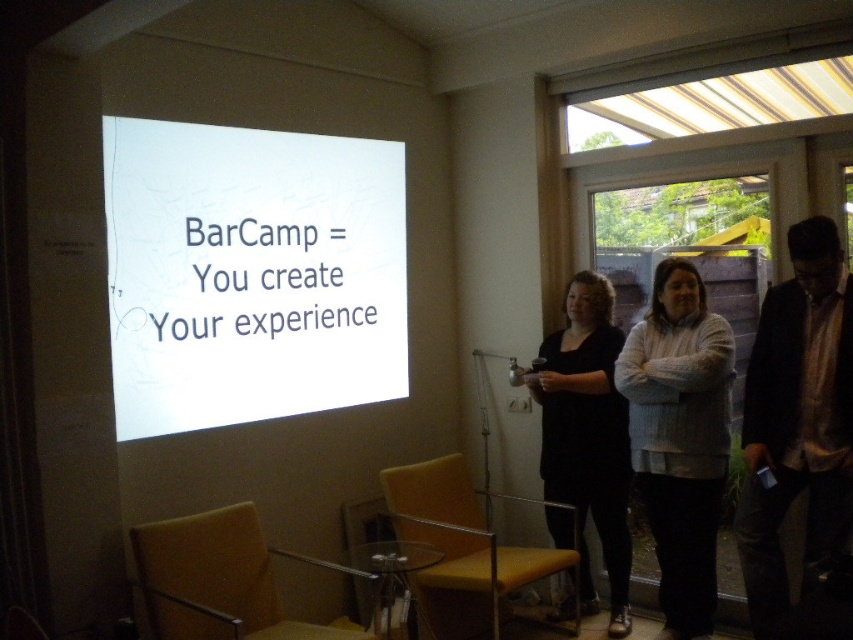
Question: Which object is closer to the camera taking this photo?

Choices:
 (A) white knitted sweater at center
 (B) matte black dress at center
 (C) white paper at upper center

Answer: (C)

Question: Is matte yellow armchair at lower left below yellow leather armchair at center?

Choices:
 (A) yes
 (B) no

Answer: (A)

Question: Which object appears farthest from the camera in this image?

Choices:
 (A) white paper at upper center
 (B) matte yellow armchair at lower left
 (C) white knitted sweater at center
 (D) dark brown suit at right

Answer: (C)

Question: Is dark brown suit at right thinner than white knitted sweater at center?

Choices:
 (A) no
 (B) yes

Answer: (B)

Question: Does dark brown suit at right appear under matte yellow armchair at lower left?

Choices:
 (A) yes
 (B) no

Answer: (B)

Question: Which of these objects is positioned farthest from the matte black dress at center?

Choices:
 (A) dark brown suit at right
 (B) matte yellow armchair at lower left
 (C) white paper at upper center

Answer: (B)